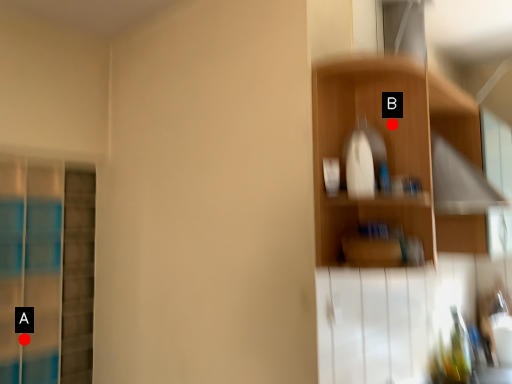
Question: Two points are circled on the image, labeled by A and B beside each circle. Among these points, which one is nearest to the camera?

Choices:
 (A) A is closer
 (B) B is closer

Answer: (B)